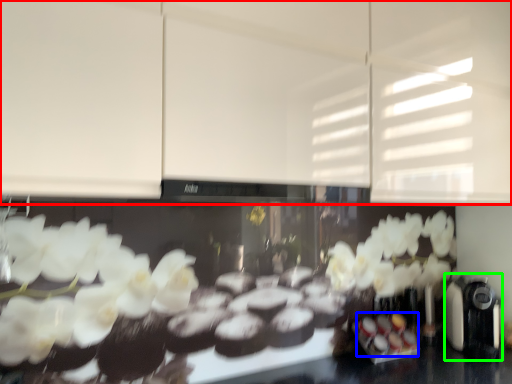
Question: Considering the real-world distances, which object is closest to cabinetry (highlighted by a red box)? food (highlighted by a blue box) or coffee machine (highlighted by a green box).

Choices:
 (A) food
 (B) coffee machine

Answer: (B)